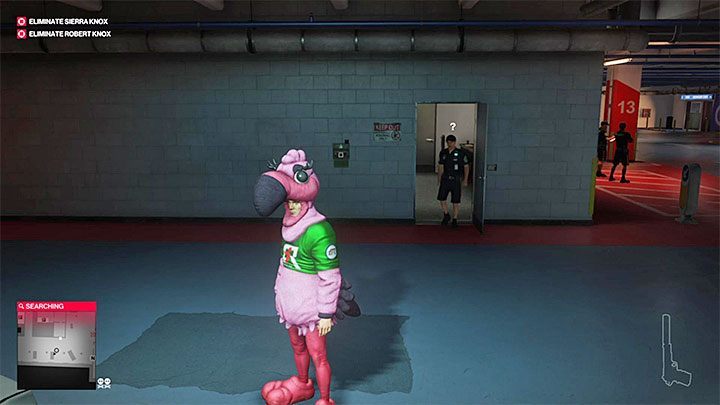
The image size is (720, 405). In order to click on concrete wall in this screenshot , I will do `click(526, 143)`.